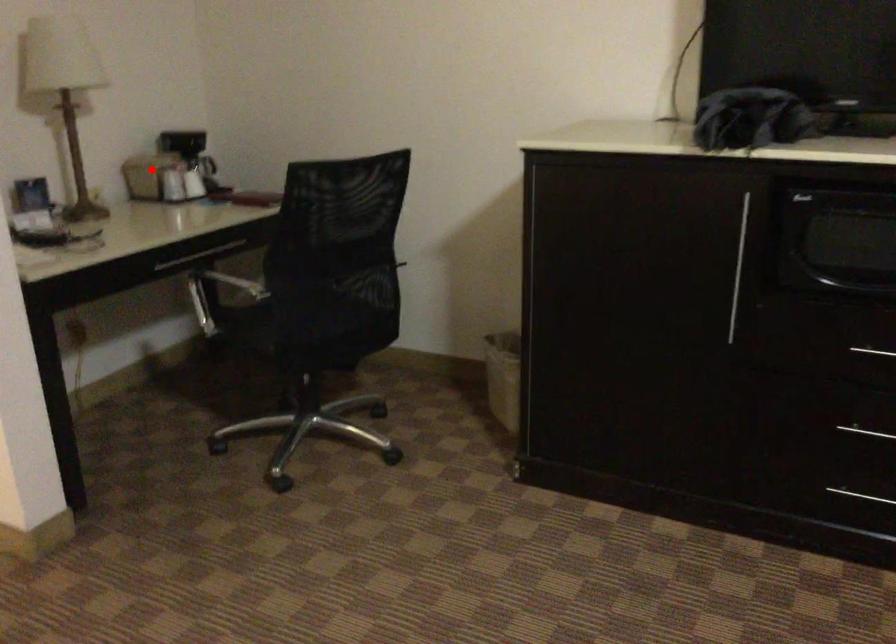
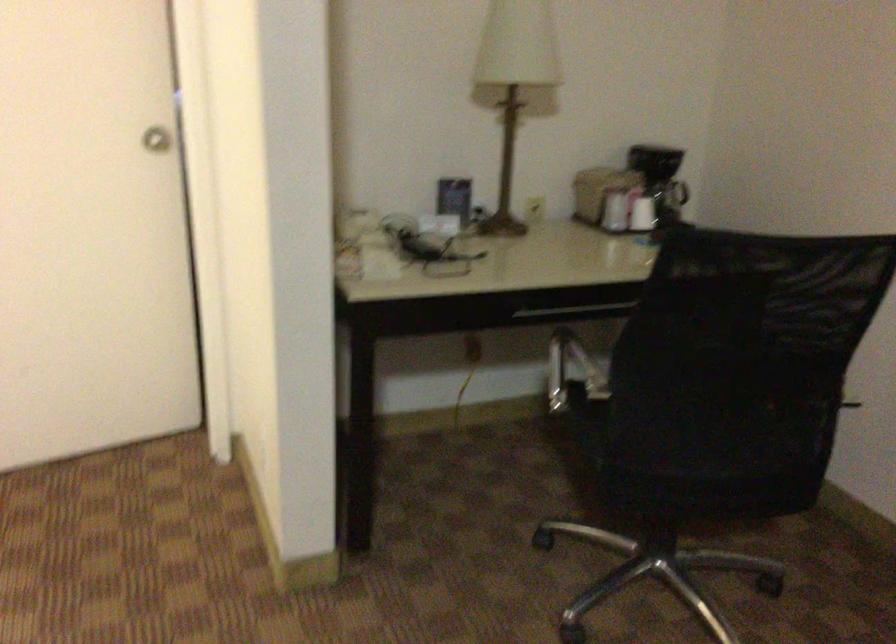
Find the pixel in the second image that matches the highlighted location in the first image.

(598, 192)